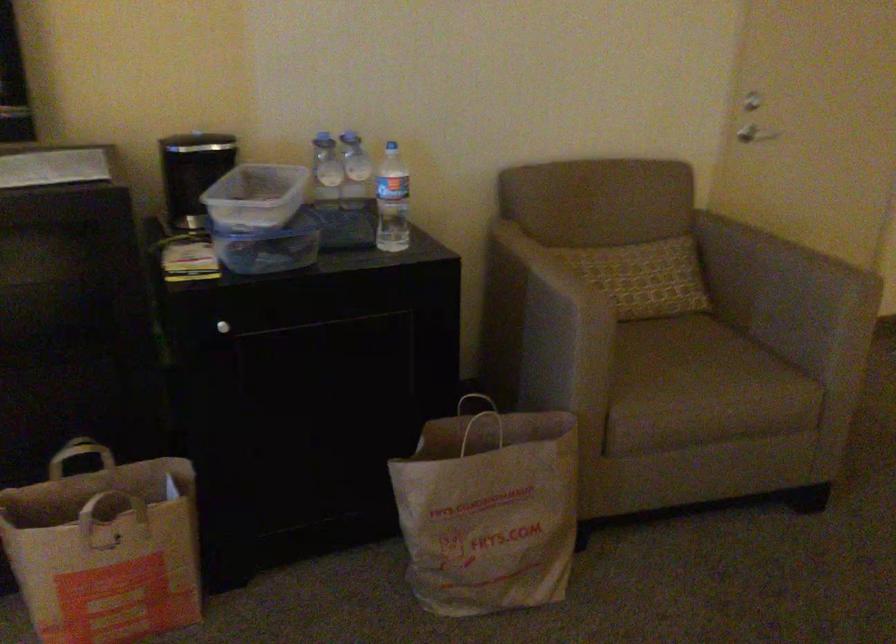
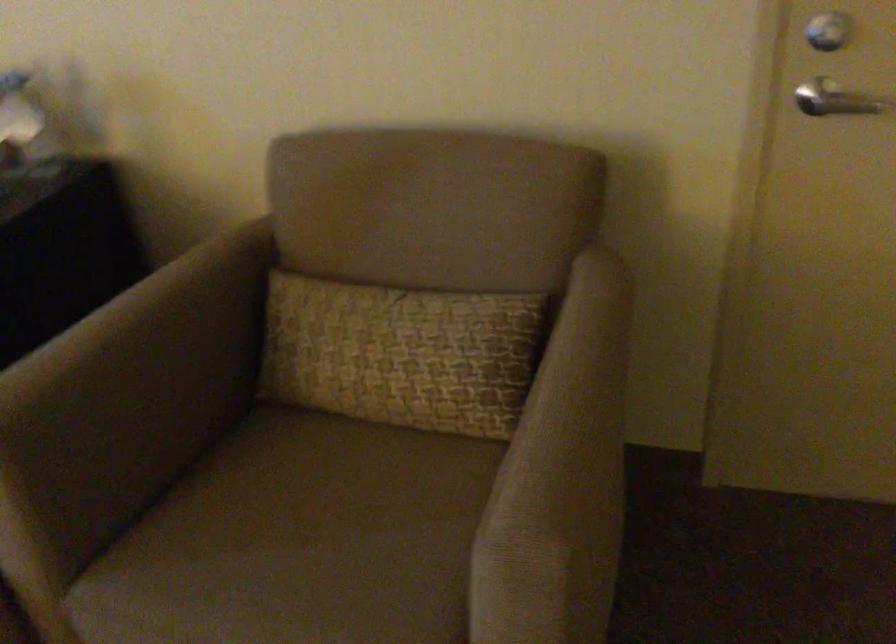
In the second image, find the point that corresponds to [659,348] in the first image.

(314, 500)